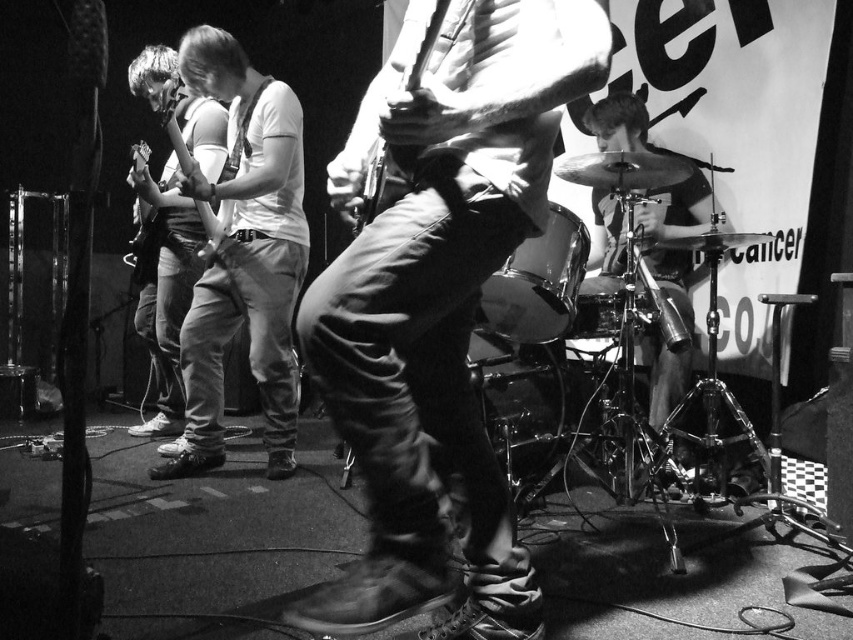
Question: Observing the image, what is the correct spatial positioning of matte white guitar at center in reference to metallic silver guitar at center?

Choices:
 (A) left
 (B) right

Answer: (A)

Question: Which of the following is the closest to the observer?

Choices:
 (A) [x=376, y=193]
 (B) [x=274, y=204]
 (C) [x=173, y=337]
 (D) [x=357, y=355]

Answer: (D)

Question: Estimate the real-world distances between objects in this image. Which object is farther from the matte white guitar at center?

Choices:
 (A) metallic silver guitar at center
 (B) leather boots at center
 (C) denim pants at center

Answer: (A)

Question: Which point is farther from the camera taking this photo?

Choices:
 (A) (161, 61)
 (B) (283, 100)
 (C) (354, 212)

Answer: (A)

Question: Does matte white guitar at center appear on the right side of denim pants at center?

Choices:
 (A) no
 (B) yes

Answer: (B)

Question: Observing the image, what is the correct spatial positioning of matte white guitar at center in reference to denim pants at center?

Choices:
 (A) below
 (B) above

Answer: (A)